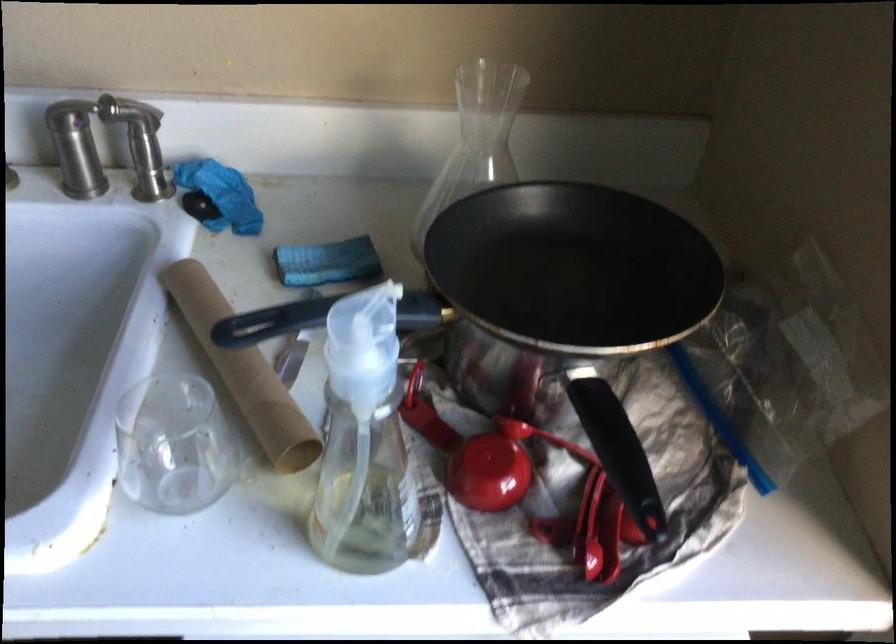
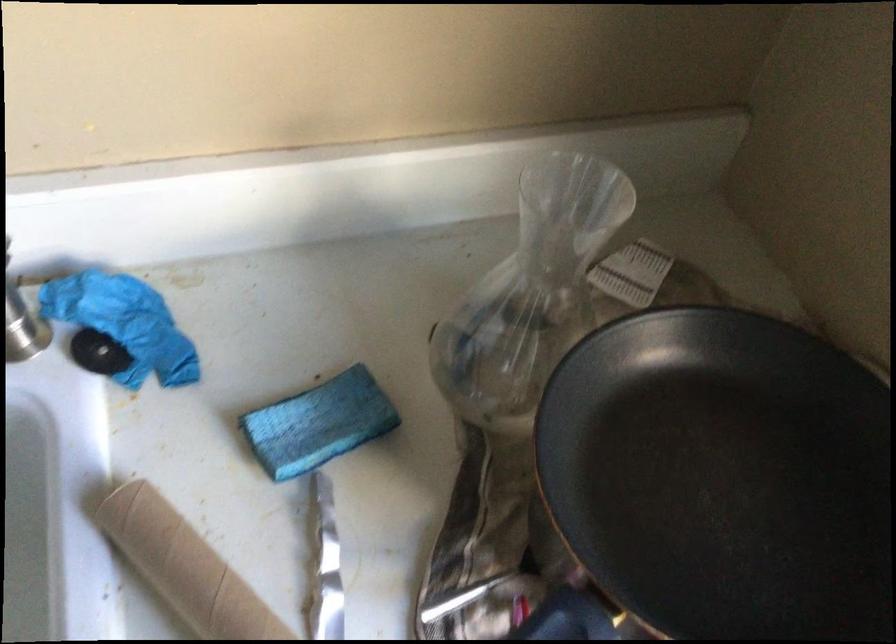
Question: Based on the continuous images, in which direction is the camera rotating? Reply with the corresponding letter.

Choices:
 (A) Left
 (B) Right
 (C) Up
 (D) Down

Answer: (D)